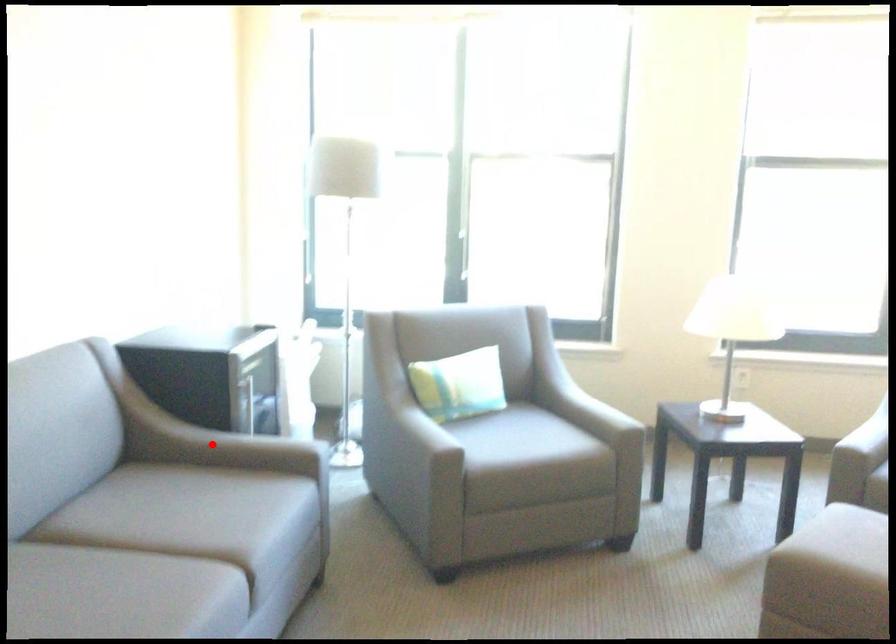
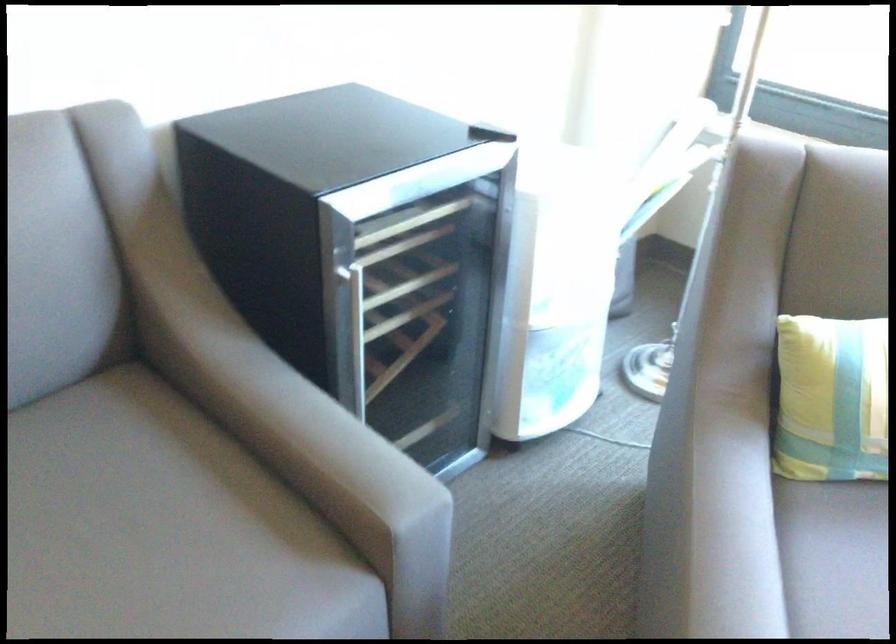
Question: I am providing you with two images of the same scene from different viewpoints. A red point is marked on the first image. Is the red point's position out of view in image 2?

Choices:
 (A) Yes
 (B) No

Answer: (A)